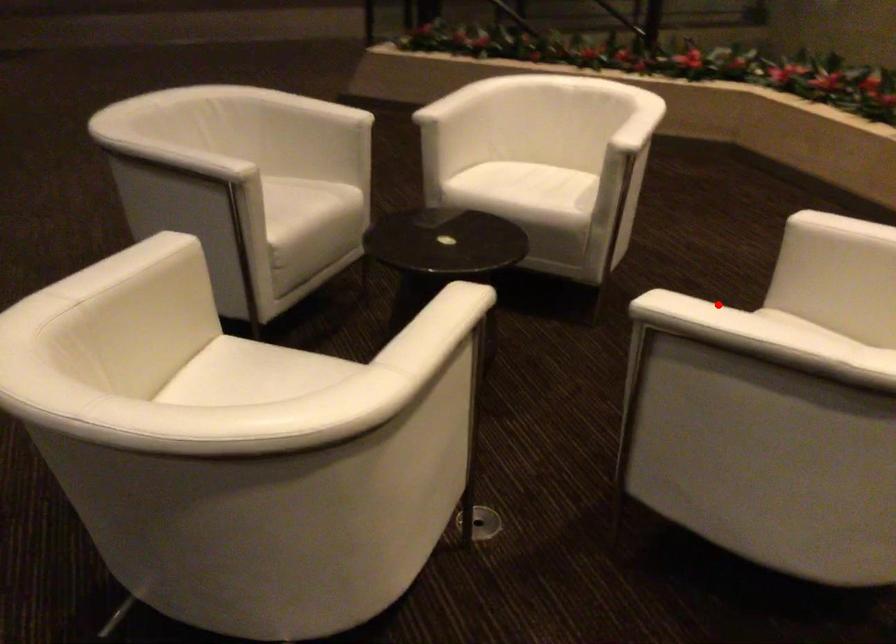
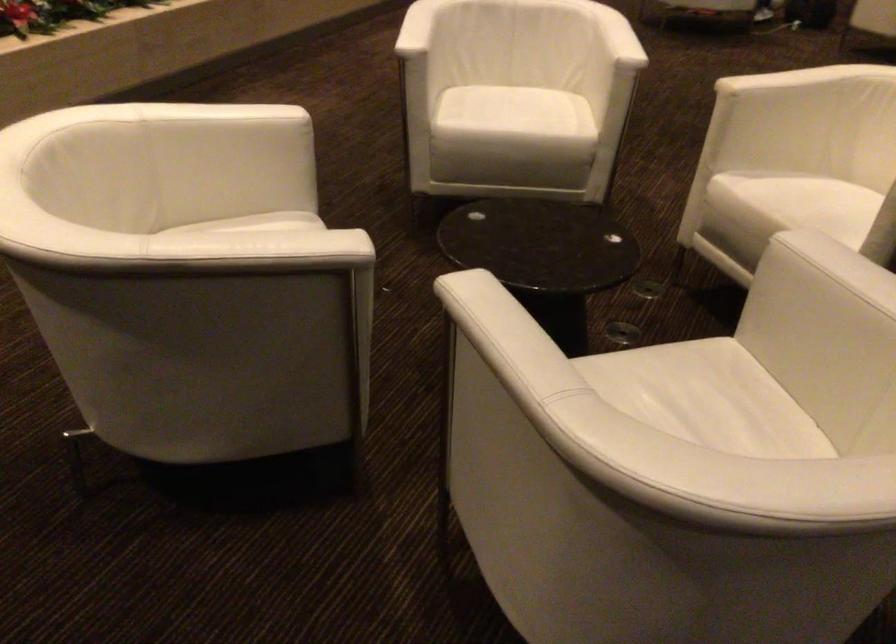
Question: A red point is marked in image1. In image2, is the corresponding 3D point closer to the camera or farther? Reply with the corresponding letter.

Choices:
 (A) The corresponding 3D point is closer.
 (B) The corresponding 3D point is farther.

Answer: (B)